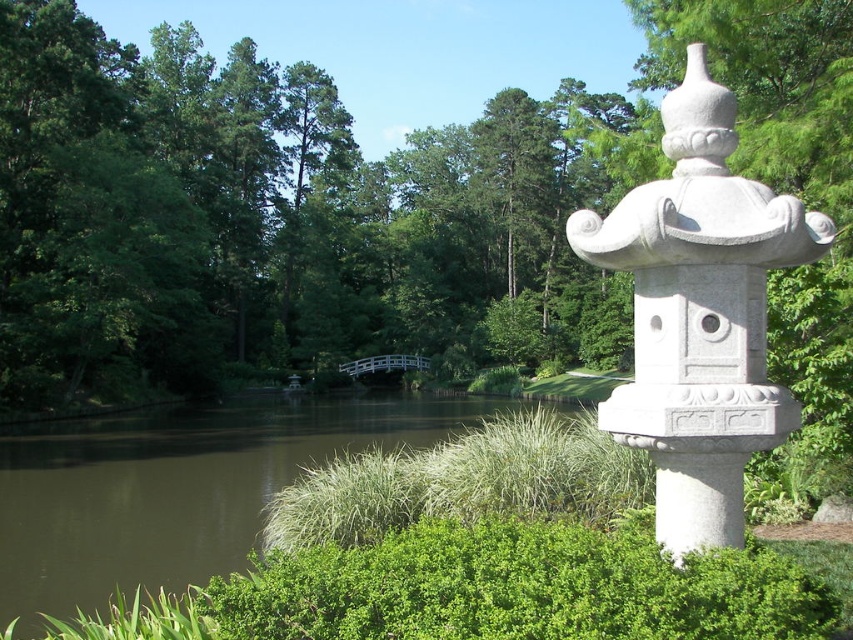
Question: Which point is closer to the camera taking this photo?

Choices:
 (A) (106, 497)
 (B) (692, 480)

Answer: (B)

Question: Is white stone lantern at upper right closer to the viewer compared to brown water at center?

Choices:
 (A) yes
 (B) no

Answer: (A)

Question: Is white stone lantern at upper right bigger than brown water at center?

Choices:
 (A) yes
 (B) no

Answer: (B)

Question: Which point appears farthest from the camera in this image?

Choices:
 (A) (216, 472)
 (B) (694, 218)

Answer: (A)

Question: Is white stone lantern at upper right further to camera compared to brown water at center?

Choices:
 (A) yes
 (B) no

Answer: (B)

Question: Which of the following is the farthest from the observer?

Choices:
 (A) (241, 422)
 (B) (675, 460)

Answer: (A)